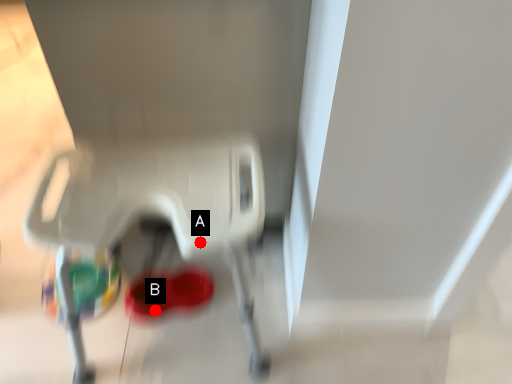
Question: Two points are circled on the image, labeled by A and B beside each circle. Which point is closer to the camera?

Choices:
 (A) A is closer
 (B) B is closer

Answer: (A)